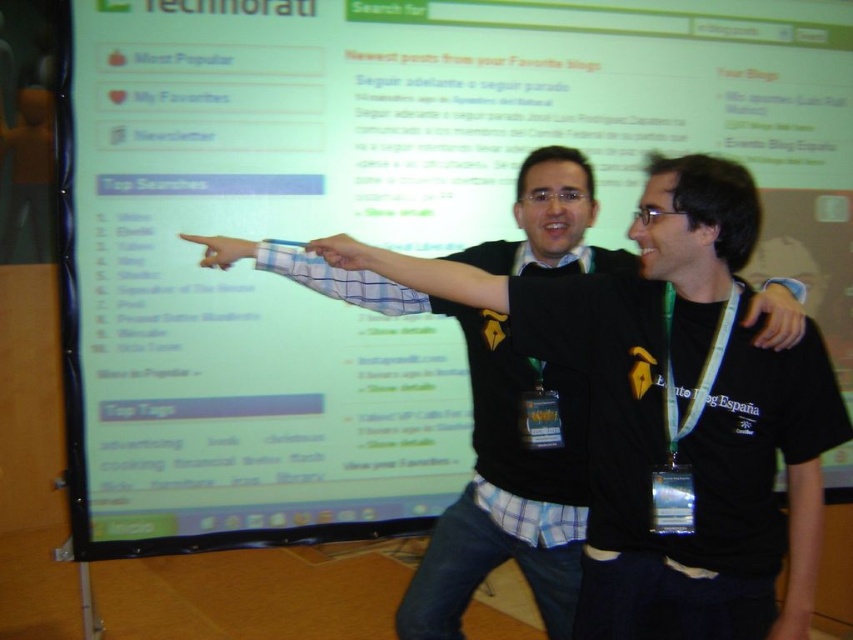
You are an assistant at the presentation. You need to hand the matte blue pen at upper center to the presenter. Which direction should you move relative to the matte blue shirt at upper center?

The matte blue shirt at upper center is to the right of the matte blue pen at upper center, so you should move to the left relative to the matte blue shirt at upper center to reach the pen.

You are an observer in the room and want to know which object is smaller between the matte black hand at upper right and the matte blue pen at upper center. Based on the scene, can you determine which one is smaller?

The matte black hand at upper right is smaller than the matte blue pen at upper center according to the description.